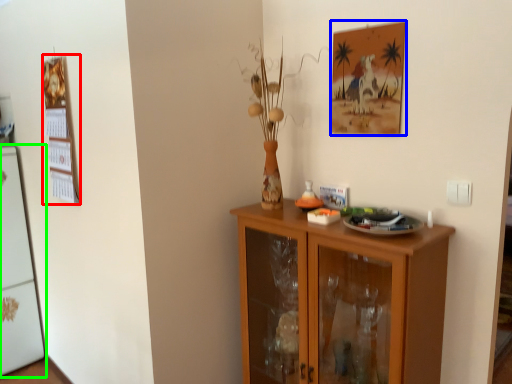
Question: Based on their relative distances, which object is farther from bulletin board (highlighted by a red box)? Choose from picture frame (highlighted by a blue box) and fridge (highlighted by a green box).

Choices:
 (A) picture frame
 (B) fridge

Answer: (A)